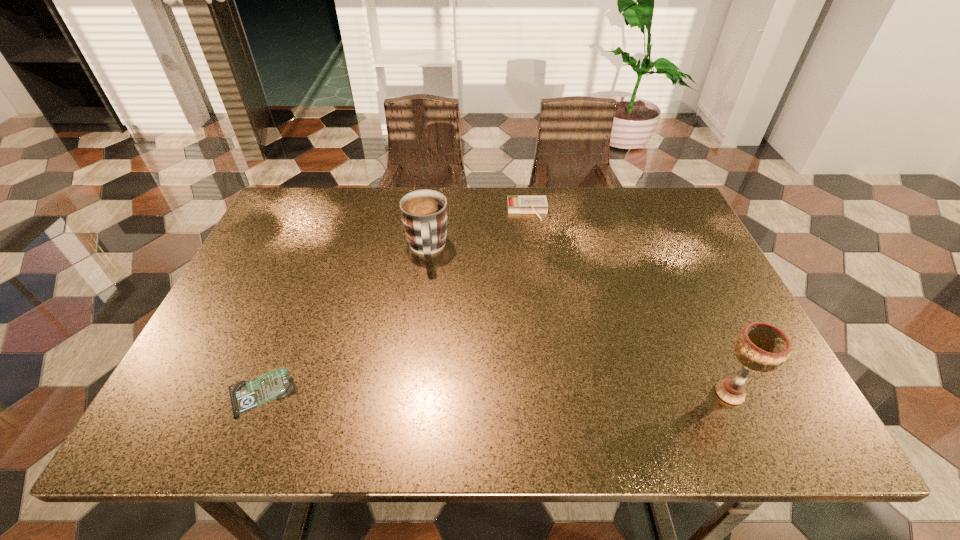
Identify the location of object that is the nearest to the matchbox. The width and height of the screenshot is (960, 540). (424, 214).

Select which object appears as the second closest to the rightmost object. Please provide its 2D coordinates. Your answer should be formatted as a tuple, i.e. [(x, y)], where the tuple contains the x and y coordinates of a point satisfying the conditions above.

[(424, 214)]

Where is `free space that satisfies the following two spatial constraints: 1. on the front side of the rightmost object; 2. on the left side of the matchbox`? This screenshot has width=960, height=540. free space that satisfies the following two spatial constraints: 1. on the front side of the rightmost object; 2. on the left side of the matchbox is located at coordinates (551, 393).

Identify the location of free space that satisfies the following two spatial constraints: 1. on the front side of the chalice; 2. on the right side of the second object from right to left. This screenshot has width=960, height=540. (551, 393).

Identify the location of free space in the image that satisfies the following two spatial constraints: 1. on the back side of the third object from right to left; 2. on the right side of the identity card. (320, 248).